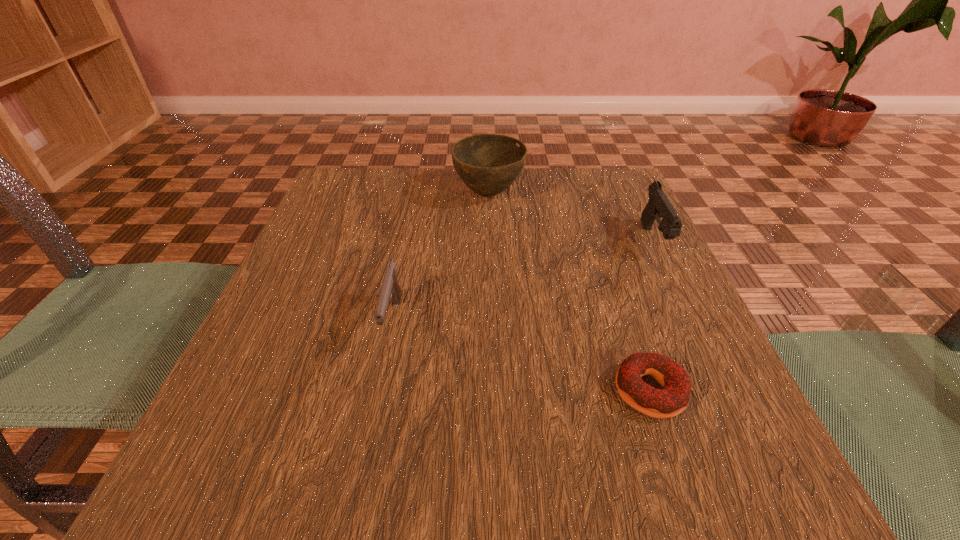
At what (x,y) coordinates should I click in order to perform the action: click on vacant region located 0.080m at the barrel of the nearer pistol. Please return your answer as a coordinate pair (x, y). The height and width of the screenshot is (540, 960). Looking at the image, I should click on (377, 397).

Where is `free space located 0.080m on the front of the nearest object`? The height and width of the screenshot is (540, 960). free space located 0.080m on the front of the nearest object is located at coordinates (681, 482).

The height and width of the screenshot is (540, 960). What are the coordinates of `bowl that is at the far edge` in the screenshot? It's located at (488, 164).

Find the location of a particular element. The height and width of the screenshot is (540, 960). pistol present at the far edge is located at coordinates (658, 205).

Find the location of a particular element. The image size is (960, 540). pistol that is at the right edge is located at coordinates (658, 205).

Find the location of `doughnut located at the right edge`. doughnut located at the right edge is located at coordinates pos(670,401).

Image resolution: width=960 pixels, height=540 pixels. I want to click on object present at the far right corner, so click(658, 205).

Locate an element on the screen. free space at the far edge of the desktop is located at coordinates (403, 210).

In the image, there is a desktop. Where is `free region at the near edge`? free region at the near edge is located at coordinates (567, 500).

Where is `vacant space at the left edge of the desktop`? This screenshot has height=540, width=960. vacant space at the left edge of the desktop is located at coordinates click(353, 324).